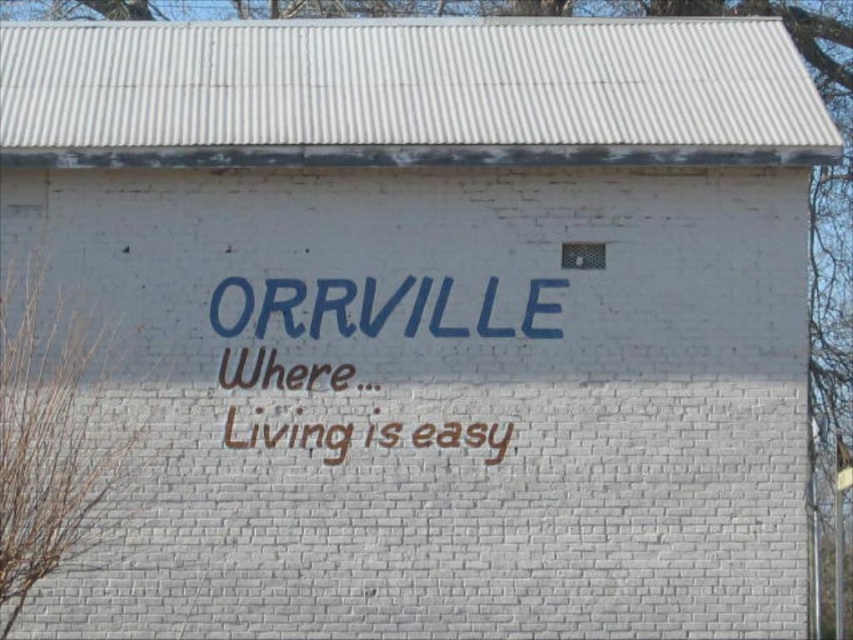
Is point (529, 314) more distant than point (274, 353)?

Yes, it is behind point (274, 353).

Between blue painted text at center and brownmaterial/texturewriting at center, which one has less height?

Standing shorter between the two is blue painted text at center.

Who is more distant from viewer, (320, 330) or (485, 424)?

The point (485, 424) is more distant.

The height and width of the screenshot is (640, 853). In order to click on blue painted text at center in this screenshot , I will do `click(397, 307)`.